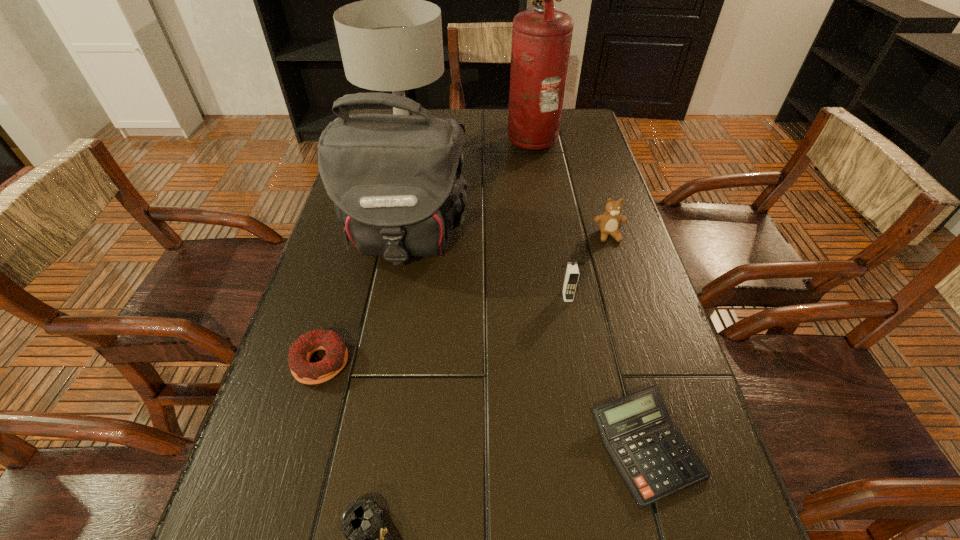
At what (x,y) coordinates should I click in order to perform the action: click on vacant space located at the front of the tallest object where the nozzle is aimed. Please return your answer as a coordinate pair (x, y). Looking at the image, I should click on (454, 138).

Image resolution: width=960 pixels, height=540 pixels. I want to click on vacant point located 0.250m on the front-facing side of the lampshade, so click(x=527, y=145).

At what (x,y) coordinates should I click in order to perform the action: click on free space located on the open flap of the shoulder bag. Please return your answer as a coordinate pair (x, y). This screenshot has height=540, width=960. Looking at the image, I should click on (376, 394).

The image size is (960, 540). I want to click on vacant space located on the front-facing side of the cellular telephone, so click(579, 358).

Locate an element on the screen. vacant area situated 0.290m on the front-facing side of the fifth tallest object is located at coordinates pos(642,342).

Locate an element on the screen. The image size is (960, 540). free space located on the back of the sixth farthest object is located at coordinates (364, 216).

Identify the location of vacant space positioned 0.350m on the back of the calculator. (595, 259).

In order to click on fire extinguisher present at the far edge in this screenshot , I will do `click(541, 37)`.

Where is `lampshade located at the far edge`? The width and height of the screenshot is (960, 540). lampshade located at the far edge is located at coordinates (392, 40).

This screenshot has height=540, width=960. I want to click on lampshade that is at the left edge, so click(392, 40).